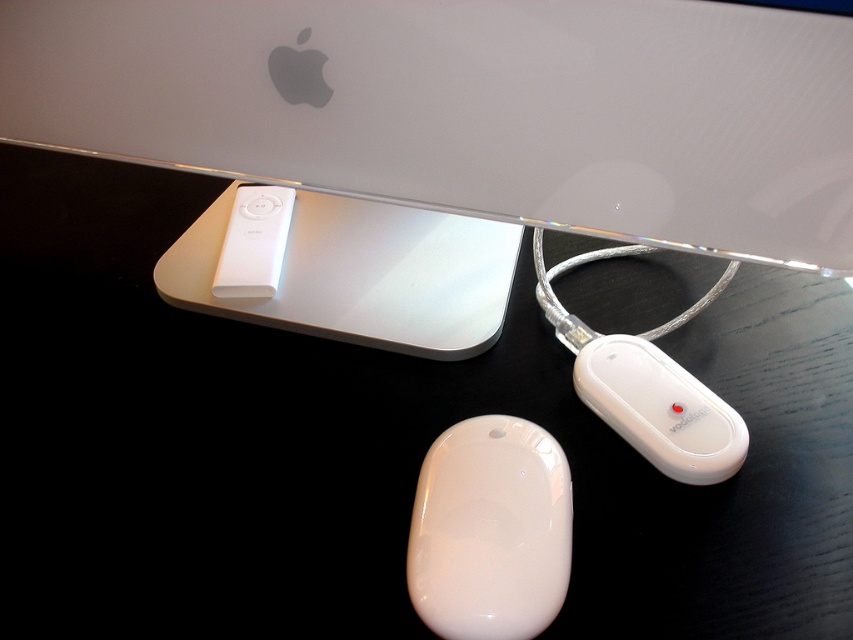
You are setting up a new workspace and want to place a wireless keyboard between the glossy white mouse at lower center and the white glossy charger at lower center. Based on their positions, where should you position the keyboard?

The glossy white mouse at lower center is located below the white glossy charger at lower center. Therefore, to place the wireless keyboard between them, position it between the lower mouse and the higher charger, ensuring it sits centrally beneath the charger but above the mouse.

You are organizing cables for a tech setup. You have a sleek silver laptop at upper center and a white glossy charger at lower center. Which device is positioned closer to you?

The sleek silver laptop at upper center is closer to the viewer than the white glossy charger at lower center.

You are setting up a new Apple workspace and need to place the glossy white mouse at lower center and the white glossy charger at lower center. According to the image, which item is located to the left of the other?

The glossy white mouse at lower center is positioned on the left side of white glossy charger at lower center.